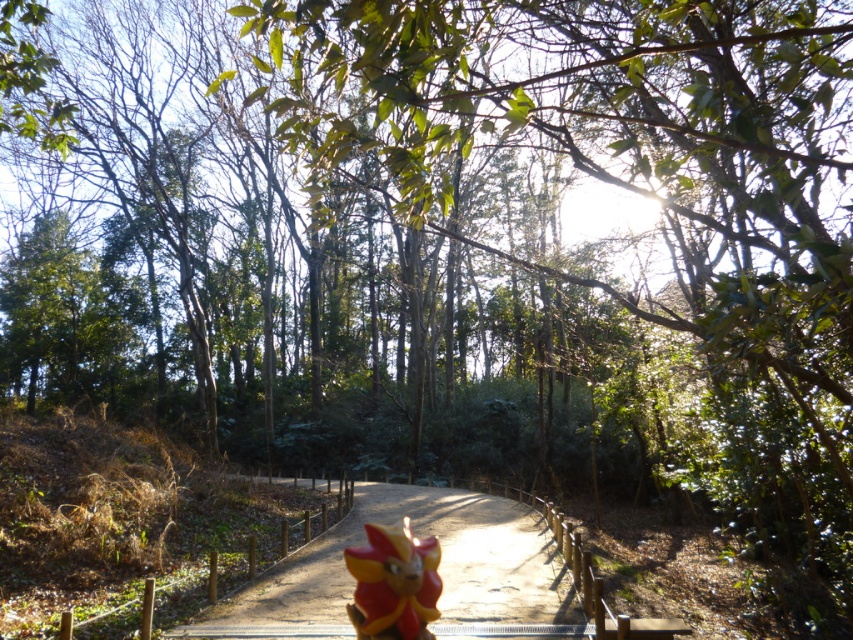
Does point (341, 604) lie in front of point (410, 611)?

No, (341, 604) is behind (410, 611).

Between smooth wooden path at center and shiny red flower at center, which one is positioned higher?

shiny red flower at center is higher up.

Who is more distant from viewer, (335,618) or (381,534)?

Positioned behind is point (335,618).

Where is `smooth wooden path at center`? Image resolution: width=853 pixels, height=640 pixels. smooth wooden path at center is located at coordinates click(438, 572).